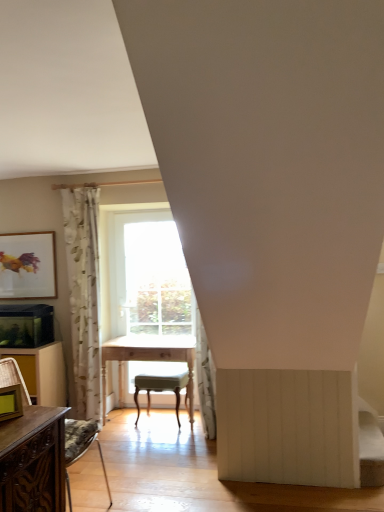
The height and width of the screenshot is (512, 384). Describe the element at coordinates (81, 448) in the screenshot. I see `wooden chair at left` at that location.

What do you see at coordinates (10, 402) in the screenshot? Image resolution: width=384 pixels, height=512 pixels. I see `matte gold picture frame at lower left, marked as the 1th picture frame in a front-to-back arrangement` at bounding box center [10, 402].

Find the location of `white floral fabric curtain at left`. white floral fabric curtain at left is located at coordinates (84, 295).

The image size is (384, 512). What do you see at coordinates (161, 389) in the screenshot? I see `light green fabric stool at center` at bounding box center [161, 389].

Where is `light wood table at center`? This screenshot has height=512, width=384. light wood table at center is located at coordinates (148, 359).

Is there a large distance between white floral fabric curtain at left and wooden chair at left?

No, there isn't a large distance between white floral fabric curtain at left and wooden chair at left.

Find the location of `chair below the white floral fabric curtain at left (from a real-world perspective)`. chair below the white floral fabric curtain at left (from a real-world perspective) is located at coordinates (81, 448).

In the scene shown: How far apart are white floral fabric curtain at left and wooden chair at left?

38.43 inches.

Considering the positions of points (82, 263) and (109, 507), is point (82, 263) closer to camera compared to point (109, 507)?

That is False.

From the image's perspective, relative to light green fabric stool at center, is matte gold picture frame at lower left, which is counted as the 1th picture frame, starting from the bottom, above or below?

matte gold picture frame at lower left, which is counted as the 1th picture frame, starting from the bottom, is above light green fabric stool at center.

Is point (3, 397) positioned behind point (148, 397)?

No.

Which is correct: matte gold picture frame at lower left, which is counted as the 1th picture frame, starting from the bottom, is inside light green fabric stool at center, or outside of it?

matte gold picture frame at lower left, which is counted as the 1th picture frame, starting from the bottom, is located beyond the bounds of light green fabric stool at center.

From a real-world perspective, is matte gold picture frame at lower left, marked as the 1th picture frame in a front-to-back arrangement, on light green fabric stool at center?

Yes.

Is point (189, 382) in front of point (85, 216)?

Yes, it is in front of point (85, 216).

Which is more to the left, light wood table at center or white floral fabric curtain at left?

white floral fabric curtain at left.

Considering the sizes of objects light wood table at center and white floral fabric curtain at left in the image provided, who is taller, light wood table at center or white floral fabric curtain at left?

white floral fabric curtain at left is taller.

How distant is light wood table at center from white floral fabric curtain at left?

light wood table at center and white floral fabric curtain at left are 21.65 inches apart.

Considering the positions of objects brown wood dresser at lower left and white floral fabric curtain at left in the image provided, who is more to the left, brown wood dresser at lower left or white floral fabric curtain at left?

From the viewer's perspective, brown wood dresser at lower left appears more on the left side.

Looking at this image, are brown wood dresser at lower left and white floral fabric curtain at left located far from each other?

No, there isn't a large distance between brown wood dresser at lower left and white floral fabric curtain at left.

Which object is wider, brown wood dresser at lower left or white floral fabric curtain at left?

With larger width is brown wood dresser at lower left.

In terms of height, does light green fabric stool at center look taller or shorter compared to wooden chair at left?

In the image, light green fabric stool at center appears to be shorter than wooden chair at left.

Which of these two, light green fabric stool at center or wooden chair at left, is wider?

wooden chair at left is wider.

From the image's perspective, does light green fabric stool at center appear higher than wooden chair at left?

No, from the image's perspective, light green fabric stool at center is not on top of wooden chair at left.

Is matte gold picture frame at lower left, which is counted as the 1th picture frame, starting from the bottom, located outside white floral fabric curtain at left?

Yes.

From a real-world perspective, is matte gold picture frame at lower left, placed as the second picture frame when sorted from back to front, positioned under white floral fabric curtain at left based on gravity?

Yes, from a real-world perspective, matte gold picture frame at lower left, placed as the second picture frame when sorted from back to front, is below white floral fabric curtain at left.

Is matte gold picture frame at lower left, marked as the 1th picture frame in a front-to-back arrangement, far away from white floral fabric curtain at left?

Yes, matte gold picture frame at lower left, marked as the 1th picture frame in a front-to-back arrangement, and white floral fabric curtain at left are quite far apart.

Is white floral fabric curtain at left at the back of matte gold picture frame at lower left, placed as the second picture frame when sorted from back to front?

No, matte gold picture frame at lower left, placed as the second picture frame when sorted from back to front,'s orientation is not away from white floral fabric curtain at left.

Identify the location of the 1st picture frame above the brown wood dresser at lower left (from the image's perspective). (10, 402).

Is brown wood dresser at lower left positioned beyond the bounds of matte gold picture frame at lower left, marked as the second picture frame in a top-to-bottom arrangement?

Yes.

From the picture: In terms of height, does brown wood dresser at lower left look taller or shorter compared to matte gold picture frame at lower left, which is counted as the 1th picture frame, starting from the bottom?

brown wood dresser at lower left is taller than matte gold picture frame at lower left, which is counted as the 1th picture frame, starting from the bottom.

From the picture: Who is more distant, brown wood dresser at lower left or matte gold picture frame at lower left, marked as the second picture frame in a top-to-bottom arrangement?

brown wood dresser at lower left is more distant.

Image resolution: width=384 pixels, height=512 pixels. Find the location of `curtain on the left of wooden chair at left`. curtain on the left of wooden chair at left is located at coordinates (84, 295).

This screenshot has height=512, width=384. Identify the location of stool to the right of matte gold picture frame at lower left, marked as the 1th picture frame in a front-to-back arrangement. (161, 389).

Looking at the image, which one is located closer to wooden chair at left, white floral fabric curtain at left or light wood table at center?

light wood table at center.

Considering their positions, is brown wood dresser at lower left positioned further to matte gold picture frame at left, which is the first picture frame from left to right, than matte gold picture frame at lower left, marked as the second picture frame in a top-to-bottom arrangement?

The object further to matte gold picture frame at left, which is the first picture frame from left to right, is matte gold picture frame at lower left, marked as the second picture frame in a top-to-bottom arrangement.

When comparing their distances from light green fabric stool at center, does light wood table at center or white floral fabric curtain at left seem closer?

light wood table at center lies closer to light green fabric stool at center than the other object.

Looking at the image, which one is located further to wooden chair at left, light green fabric stool at center or brown wood dresser at lower left?

Based on the image, light green fabric stool at center appears to be further to wooden chair at left.

When comparing their distances from matte gold picture frame at lower left, marked as the second picture frame in a top-to-bottom arrangement, does wooden chair at left or light wood table at center seem closer?

Among the two, wooden chair at left is located nearer to matte gold picture frame at lower left, marked as the second picture frame in a top-to-bottom arrangement.

Considering their positions, is white floral fabric curtain at left positioned further to matte gold picture frame at left, the second picture frame positioned from the front, than light wood table at center?

Based on the image, light wood table at center appears to be further to matte gold picture frame at left, the second picture frame positioned from the front.

From the image, which object appears to be nearer to brown wood dresser at lower left, matte gold picture frame at left, the second picture frame positioned from the front, or wooden chair at left?

The object closer to brown wood dresser at lower left is wooden chair at left.

Based on their spatial positions, is white floral fabric curtain at left or brown wood dresser at lower left further from light wood table at center?

The object further to light wood table at center is brown wood dresser at lower left.

Where is `curtain positioned between wooden chair at left and matte gold picture frame at left, placed as the 1th picture frame when sorted from back to front, from near to far`? The width and height of the screenshot is (384, 512). curtain positioned between wooden chair at left and matte gold picture frame at left, placed as the 1th picture frame when sorted from back to front, from near to far is located at coordinates (84, 295).

Find the location of a particular element. This screenshot has height=512, width=384. table between matte gold picture frame at lower left, the 1th picture frame from the right, and light green fabric stool at center, along the z-axis is located at coordinates 148,359.

Locate an element on the screen. The height and width of the screenshot is (512, 384). curtain situated between matte gold picture frame at left, the 2th picture frame positioned from the right, and light green fabric stool at center from left to right is located at coordinates (84, 295).

Find the location of `curtain between brown wood dresser at lower left and light wood table at center`. curtain between brown wood dresser at lower left and light wood table at center is located at coordinates (x=84, y=295).